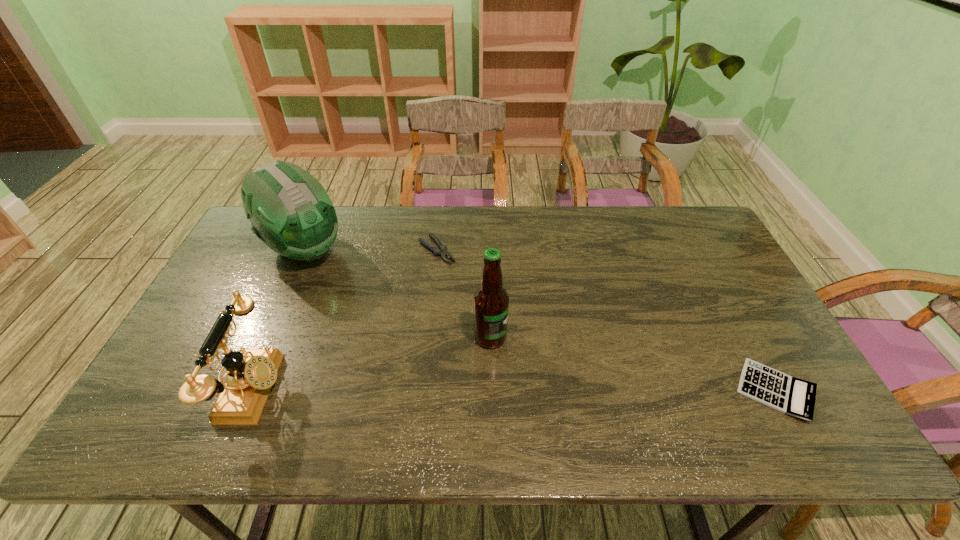
Where is `object present at the left edge`? This screenshot has height=540, width=960. object present at the left edge is located at coordinates (290, 211).

Where is `object present at the right edge`? object present at the right edge is located at coordinates (795, 397).

This screenshot has width=960, height=540. In order to click on object present at the far left corner in this screenshot , I will do `click(290, 211)`.

Find the location of `object positioned at the near right corner`. object positioned at the near right corner is located at coordinates (795, 397).

The image size is (960, 540). In the image, there is a desktop. In order to click on free space at the far edge in this screenshot , I will do `click(600, 246)`.

Locate an element on the screen. The height and width of the screenshot is (540, 960). vacant space at the near edge is located at coordinates (276, 403).

You are a GUI agent. You are given a task and a screenshot of the screen. Output one action in this format:
    pyautogui.click(x=<x>, y=<y>)
    Task: Click on the vacant area at the right edge
    The height and width of the screenshot is (540, 960).
    Given the screenshot: What is the action you would take?
    pyautogui.click(x=724, y=286)

In the image, there is a desktop. Find the location of `vacant space at the far left corner`. vacant space at the far left corner is located at coordinates (261, 247).

Where is `free space at the far right corner`? The image size is (960, 540). free space at the far right corner is located at coordinates (678, 240).

At what (x,y) coordinates should I click in order to perform the action: click on vacant area that lies between the rightmost object and the pliers. Please return your answer as a coordinate pair (x, y). Image resolution: width=960 pixels, height=540 pixels. Looking at the image, I should click on (606, 320).